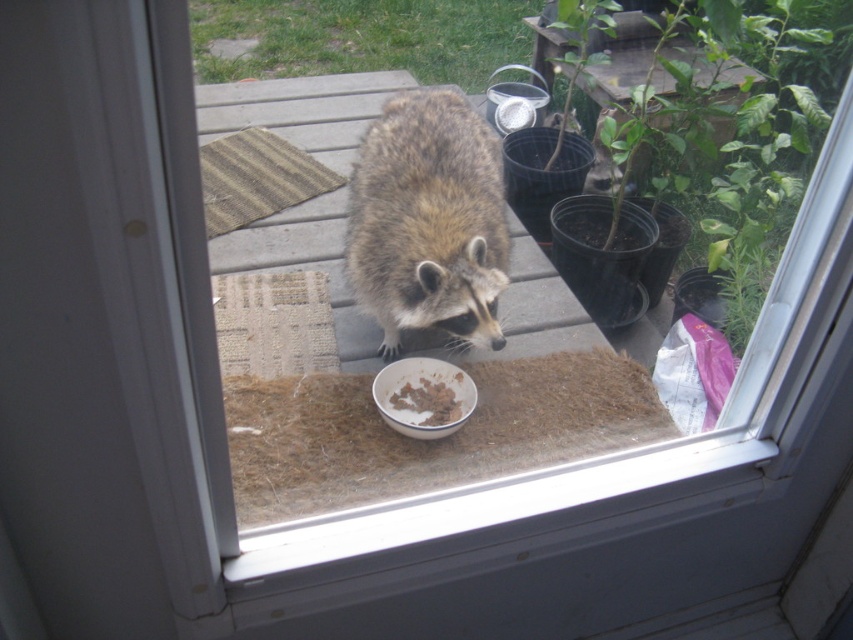
You are a wildlife photographer trying to capture a clear shot of the fuzzy brown raccoon at center and the brown crumbly food at center. Based on their sizes, which one should you focus on first to ensure the photo includes both subjects adequately?

The fuzzy brown raccoon at center is much taller than the brown crumbly food at center, so you should focus on the fuzzy brown raccoon at center first to ensure it fits in the frame with the smaller food.

Based on the scene, if you want to place a small toy between the fuzzy brown raccoon at center and the brown crumbly food at center, where should you position it?

The fuzzy brown raccoon at center is located above the brown crumbly food at center, so you should place the small toy between them either below the raccoon or above the food to ensure it is in between both objects.